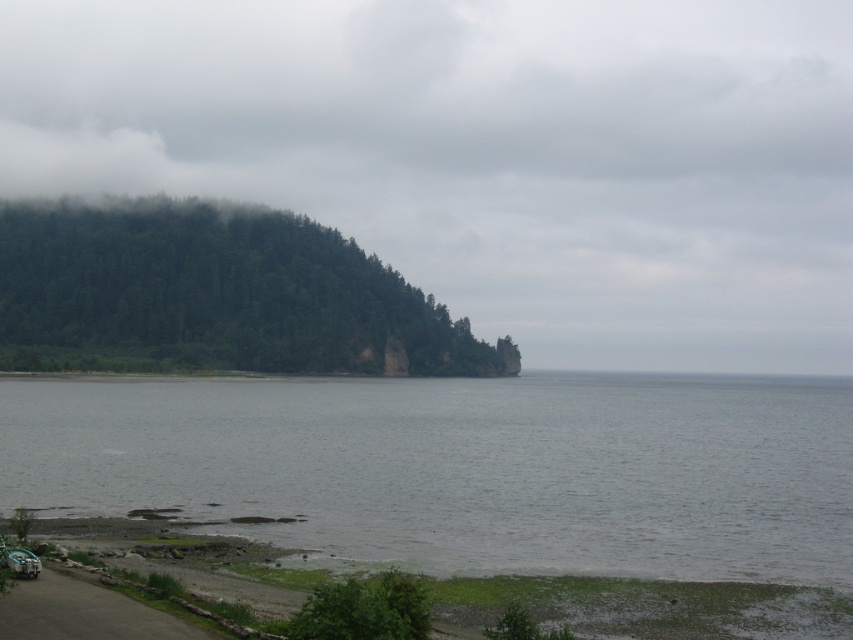
You are standing at the center of the image and want to reach the gray water at lower left. Which direction should you move in to get there?

The gray water at lower left is located at point (463, 467), so you should move towards the lower left direction to reach it.

You are standing on the shore and see the gray water at lower left and the green leafy tree at lower center. Which object is closer to your left side?

The gray water at lower left is closer to your left side because it is positioned to the left of the green leafy tree at lower center.

You are a hiker who wants to cross from the gray water at lower left to the green leafy tree at lower center. The path is straight. Your maximum walking distance is 500 feet. Can you reach the tree without exceeding your limit?

The gray water at lower left is 467.82 feet from the green leafy tree at lower center. Since your maximum walking distance is 500 feet, you can reach the tree without exceeding your limit.